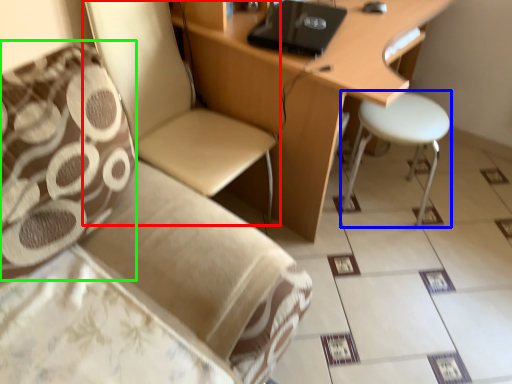
Question: Which object is positioned farthest from chair (highlighted by a red box)? Select from stool (highlighted by a blue box) and pillow (highlighted by a green box).

Choices:
 (A) stool
 (B) pillow

Answer: (A)